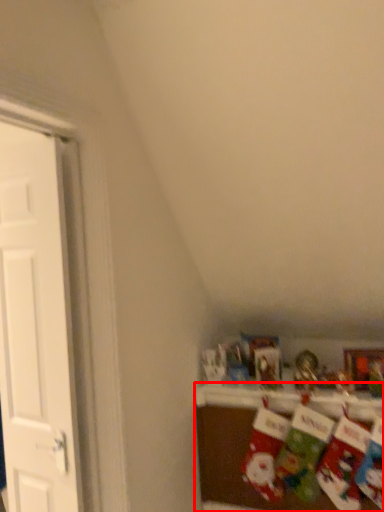
Question: From the image's perspective, what is the correct spatial positioning of shelf (annotated by the red box) in reference to door?

Choices:
 (A) above
 (B) below

Answer: (B)